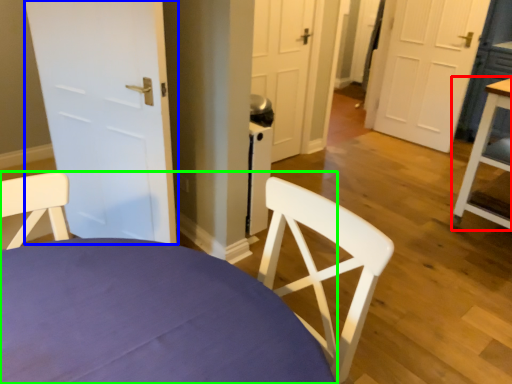
Question: Estimate the real-world distances between objects in this image. Which object is closer to table (highlighted by a red box), door (highlighted by a blue box) or chair (highlighted by a green box)?

Choices:
 (A) door
 (B) chair

Answer: (A)